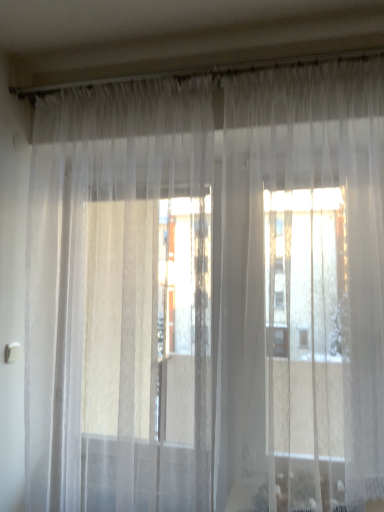
The image size is (384, 512). What do you see at coordinates (302, 290) in the screenshot?
I see `transparent sheer curtain at right` at bounding box center [302, 290].

Where is `transparent sheer curtain at right`? This screenshot has height=512, width=384. transparent sheer curtain at right is located at coordinates (302, 290).

Measure the distance between transparent sheer curtain at right and camera.

1.35 meters.

The width and height of the screenshot is (384, 512). Find the location of `transparent sheer curtain at right`. transparent sheer curtain at right is located at coordinates (302, 290).